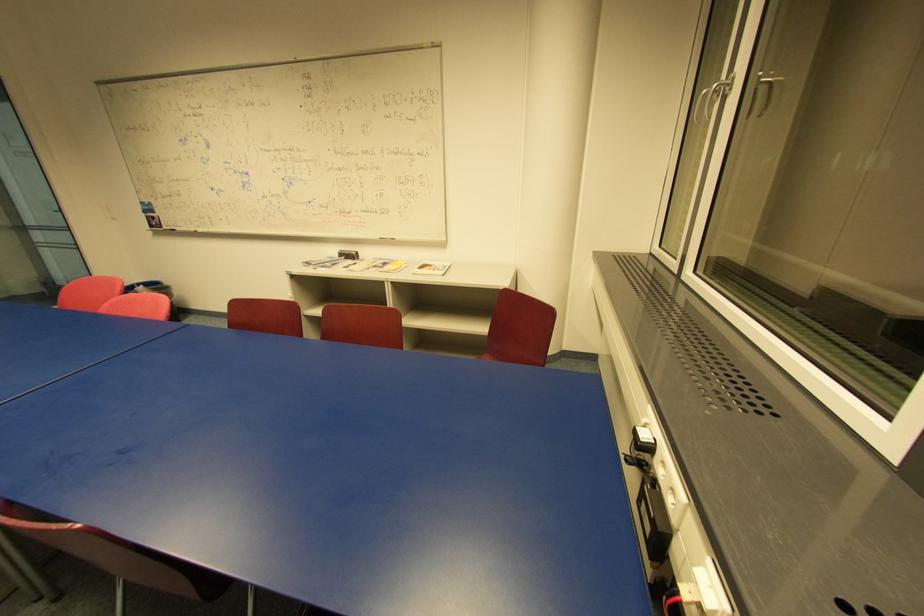
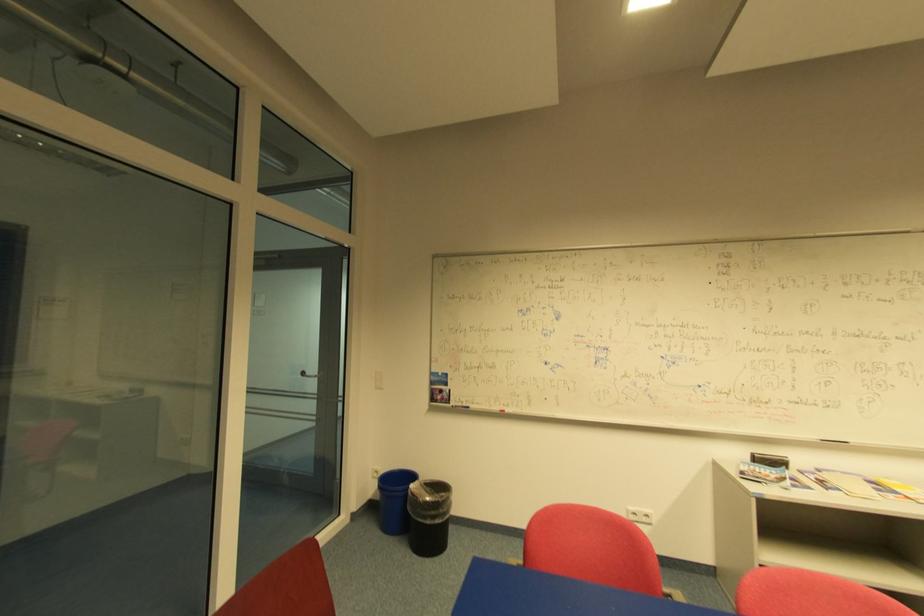
Question: In a continuous first-person perspective shot, in which direction is the camera moving?

Choices:
 (A) Left
 (B) Right
 (C) Forward
 (D) Backward

Answer: (A)